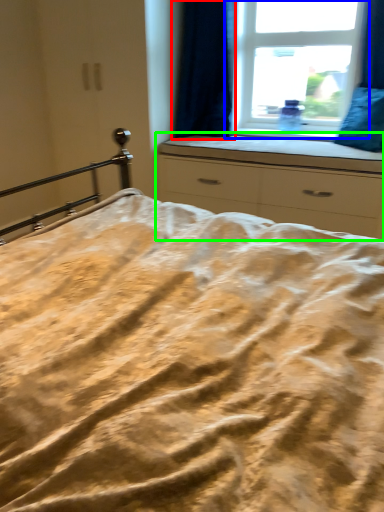
Question: Which is farther away from curtain (highlighted by a red box)? window (highlighted by a blue box) or chest of drawers (highlighted by a green box)?

Choices:
 (A) window
 (B) chest of drawers

Answer: (B)